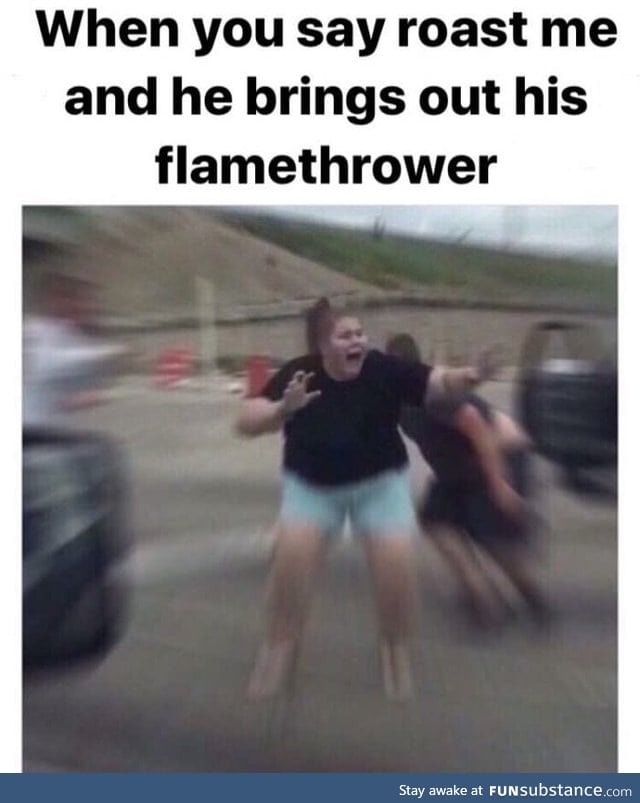
At what (x,y) coordinates should I click in order to perform the action: click on mirror. Please return your answer as a coordinate pair (x, y). Looking at the image, I should click on (563, 369).